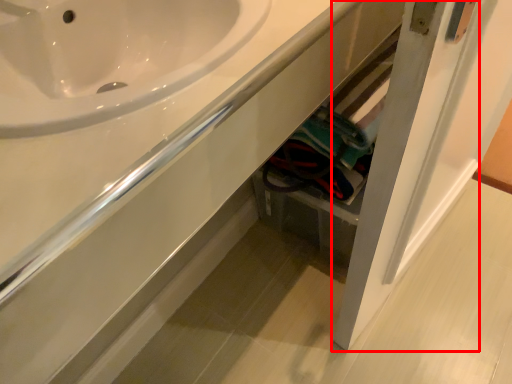
Question: From the image's perspective, where is door (annotated by the red box) located relative to counter top?

Choices:
 (A) below
 (B) above

Answer: (A)